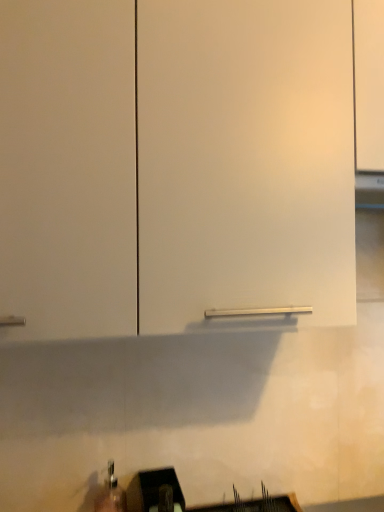
Question: Looking at their shapes, would you say black plastic sink at lower center is wider or thinner than white matte cabinet at center?

Choices:
 (A) thin
 (B) wide

Answer: (A)

Question: From a real-world perspective, relative to white matte cabinet at center, is black plastic sink at lower center vertically above or below?

Choices:
 (A) below
 (B) above

Answer: (A)

Question: In the image, is black plastic sink at lower center on the left side or the right side of white matte cabinet at center?

Choices:
 (A) right
 (B) left

Answer: (B)

Question: In the image, is white matte cabinet at center positioned in front of or behind black plastic sink at lower center?

Choices:
 (A) front
 (B) behind

Answer: (A)

Question: Is white matte cabinet at center wider or thinner than black plastic sink at lower center?

Choices:
 (A) wide
 (B) thin

Answer: (A)

Question: Considering the relative positions of white matte cabinet at center and black plastic sink at lower center in the image provided, is white matte cabinet at center to the left or to the right of black plastic sink at lower center?

Choices:
 (A) right
 (B) left

Answer: (A)

Question: From a real-world perspective, relative to black plastic sink at lower center, is white matte cabinet at center vertically above or below?

Choices:
 (A) below
 (B) above

Answer: (B)